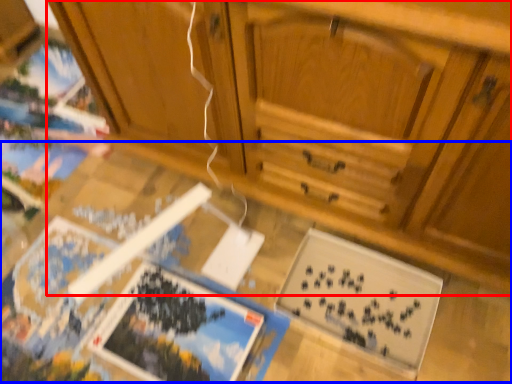
Question: Which of the following is the farthest to the observer, cabinetry (highlighted by a red box) or table (highlighted by a blue box)?

Choices:
 (A) cabinetry
 (B) table

Answer: (B)